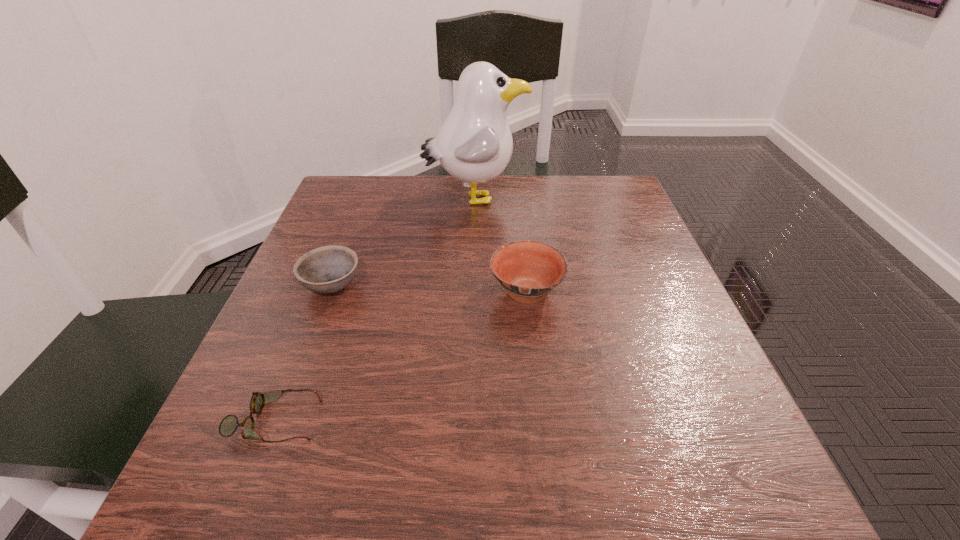
Locate an element on the screen. free space between the second shortest object and the farthest object is located at coordinates (403, 242).

Identify which object is the second nearest to the second shortest object. Please provide its 2D coordinates. Your answer should be formatted as a tuple, i.e. [(x, y)], where the tuple contains the x and y coordinates of a point satisfying the conditions above.

[(474, 145)]

Locate an element on the screen. The width and height of the screenshot is (960, 540). object that is the third nearest to the shortest object is located at coordinates (474, 145).

Locate an element on the screen. The height and width of the screenshot is (540, 960). free space that satisfies the following two spatial constraints: 1. on the beak of the farthest object; 2. on the front side of the shorter bowl is located at coordinates click(472, 286).

Where is `free spot that satisfies the following two spatial constraints: 1. on the beak of the taller bowl; 2. on the right side of the tallest object`? The image size is (960, 540). free spot that satisfies the following two spatial constraints: 1. on the beak of the taller bowl; 2. on the right side of the tallest object is located at coordinates click(x=472, y=293).

I want to click on vacant area in the image that satisfies the following two spatial constraints: 1. on the beak of the tallest object; 2. on the back side of the second tallest object, so click(472, 293).

Find the location of `free location that satisfies the following two spatial constraints: 1. on the beak of the taller bowl; 2. on the left side of the gull`. free location that satisfies the following two spatial constraints: 1. on the beak of the taller bowl; 2. on the left side of the gull is located at coordinates (472, 293).

Where is `free space in the image that satisfies the following two spatial constraints: 1. on the beak of the gull; 2. on the right side of the taller bowl`? free space in the image that satisfies the following two spatial constraints: 1. on the beak of the gull; 2. on the right side of the taller bowl is located at coordinates [x=472, y=293].

Locate an element on the screen. The width and height of the screenshot is (960, 540). vacant position in the image that satisfies the following two spatial constraints: 1. on the front side of the third shortest object; 2. on the front-facing side of the shortest object is located at coordinates (x=540, y=421).

Where is `vacant space that satisfies the following two spatial constraints: 1. on the beak of the taller bowl; 2. on the right side of the tallest object`? vacant space that satisfies the following two spatial constraints: 1. on the beak of the taller bowl; 2. on the right side of the tallest object is located at coordinates (472, 293).